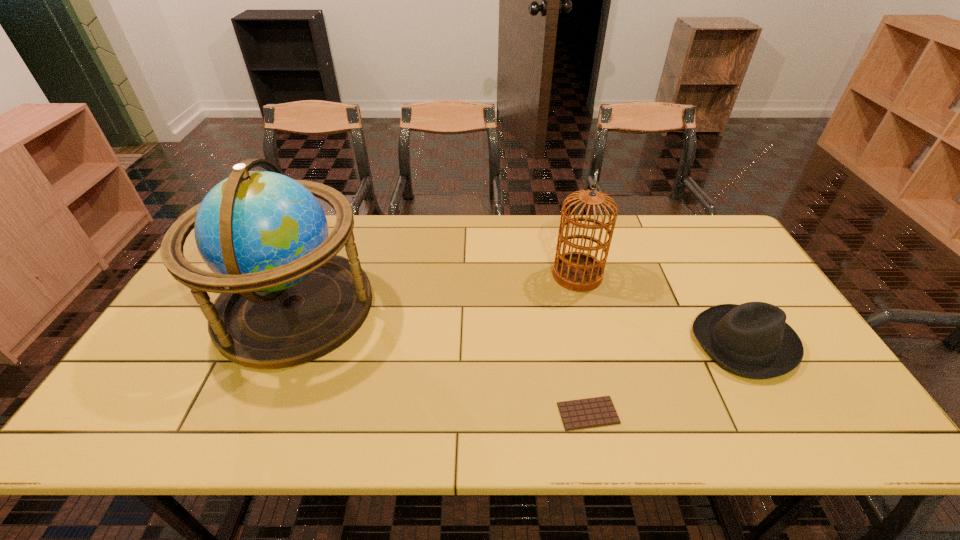
Where is `vacant region located on the back of the chocolate bar`? vacant region located on the back of the chocolate bar is located at coordinates (579, 369).

Locate an element on the screen. object located at the far edge is located at coordinates (286, 298).

You are a GUI agent. You are given a task and a screenshot of the screen. Output one action in this format:
    pyautogui.click(x=<x>, y=<y>)
    Task: Click on the object located in the near edge section of the desktop
    Image resolution: width=960 pixels, height=540 pixels.
    Given the screenshot: What is the action you would take?
    pyautogui.click(x=599, y=411)

The image size is (960, 540). Identify the location of object present at the left edge. (286, 298).

This screenshot has height=540, width=960. In order to click on object present at the right edge in this screenshot , I will do `click(752, 339)`.

The image size is (960, 540). I want to click on object located in the far left corner section of the desktop, so click(x=286, y=298).

Locate an element on the screen. This screenshot has height=540, width=960. vacant region at the far edge of the desktop is located at coordinates (477, 222).

Where is `free region at the near edge of the desktop`? Image resolution: width=960 pixels, height=540 pixels. free region at the near edge of the desktop is located at coordinates (218, 433).

Locate an element on the screen. free space at the left edge of the desktop is located at coordinates (161, 339).

Image resolution: width=960 pixels, height=540 pixels. In the image, there is a desktop. Find the location of `free space at the right edge`. free space at the right edge is located at coordinates (805, 399).